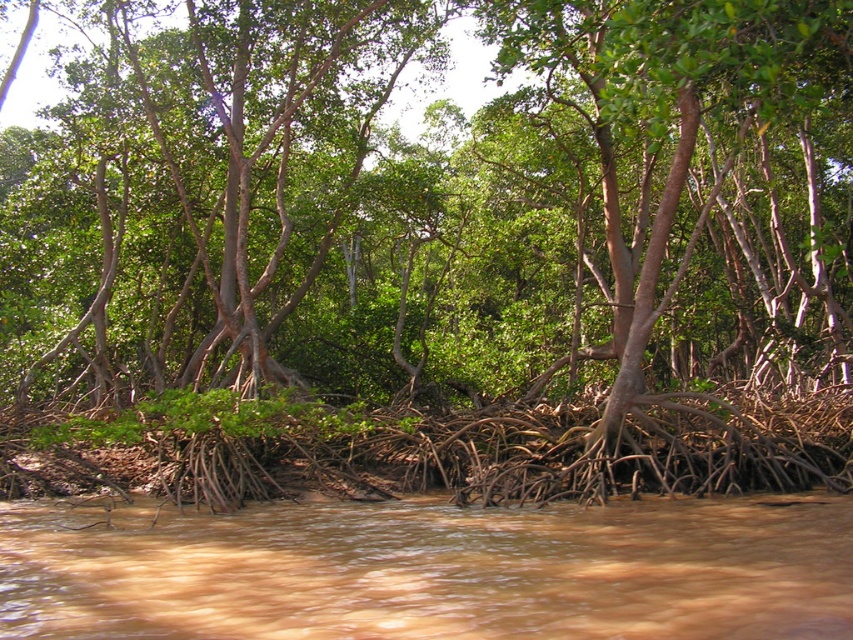
Question: Among these points, which one is nearest to the camera?

Choices:
 (A) (91, 136)
 (B) (830, 636)

Answer: (B)

Question: Does green matte tree at center have a larger size compared to brown muddy water at lower center?

Choices:
 (A) no
 (B) yes

Answer: (B)

Question: Is green matte tree at center positioned at the back of brown muddy water at lower center?

Choices:
 (A) no
 (B) yes

Answer: (B)

Question: Which point is closer to the camera?

Choices:
 (A) (380, 547)
 (B) (231, 209)

Answer: (A)

Question: Does green matte tree at center have a lesser width compared to brown muddy water at lower center?

Choices:
 (A) yes
 (B) no

Answer: (B)